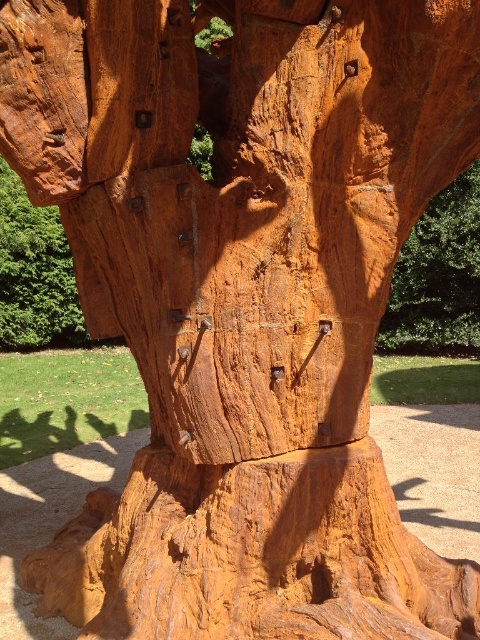
Is smooth orange wood at upper right thinner than rustic wood carving at upper left?

Incorrect, smooth orange wood at upper right's width is not less than rustic wood carving at upper left's.

Is smooth orange wood at upper right shorter than rustic wood carving at upper left?

Indeed, smooth orange wood at upper right has a lesser height compared to rustic wood carving at upper left.

Between point (431, 236) and point (23, 221), which one is positioned behind?

Positioned behind is point (23, 221).

The height and width of the screenshot is (640, 480). I want to click on smooth orange wood at upper right, so click(437, 276).